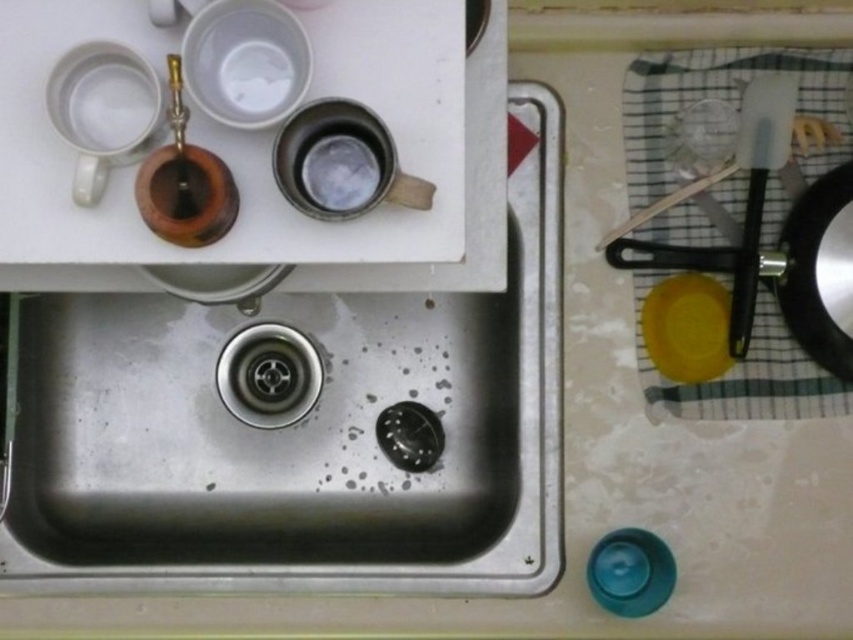
Can you confirm if stainless steel sink at center is shorter than black non-stick frying pan at right?

In fact, stainless steel sink at center may be taller than black non-stick frying pan at right.

Consider the image. Is stainless steel sink at center positioned in front of black non-stick frying pan at right?

No, stainless steel sink at center is behind black non-stick frying pan at right.

Who is more forward, (550,534) or (810,324)?

Positioned in front is point (810,324).

This screenshot has width=853, height=640. Find the location of `stainless steel sink at center`. stainless steel sink at center is located at coordinates (297, 432).